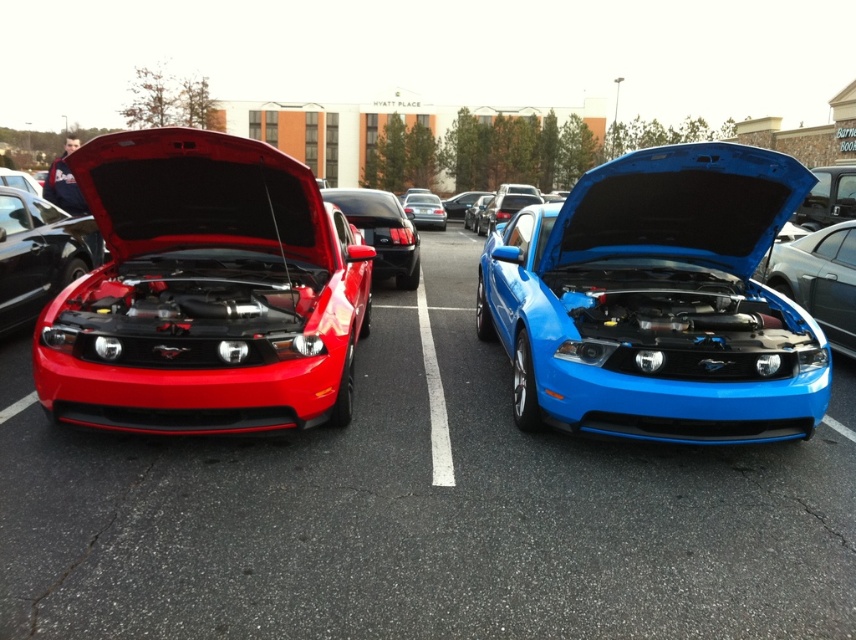
Which of these two, matte black car at left or glossy black car at center, stands shorter?

With less height is glossy black car at center.

Does matte black car at left appear over glossy black car at center?

No, matte black car at left is not above glossy black car at center.

Image resolution: width=856 pixels, height=640 pixels. Describe the element at coordinates (204, 292) in the screenshot. I see `matte black car at left` at that location.

Locate an element on the screen. This screenshot has width=856, height=640. matte black car at left is located at coordinates tap(204, 292).

Looking at this image, can you confirm if shiny blue car at center is positioned to the left of matte black car at left?

Incorrect, shiny blue car at center is not on the left side of matte black car at left.

Does shiny blue car at center have a smaller size compared to matte black car at left?

No.

Is point (795, 419) more distant than point (94, 314)?

No, (795, 419) is closer to viewer.

Locate an element on the screen. This screenshot has height=640, width=856. shiny blue car at center is located at coordinates (657, 301).

Is shiny blue car at center shorter than shiny red car at left?

No.

Does shiny blue car at center have a smaller size compared to shiny red car at left?

Incorrect, shiny blue car at center is not smaller in size than shiny red car at left.

This screenshot has height=640, width=856. What do you see at coordinates (657, 301) in the screenshot? I see `shiny blue car at center` at bounding box center [657, 301].

This screenshot has height=640, width=856. Find the location of `shiny blue car at center`. shiny blue car at center is located at coordinates (657, 301).